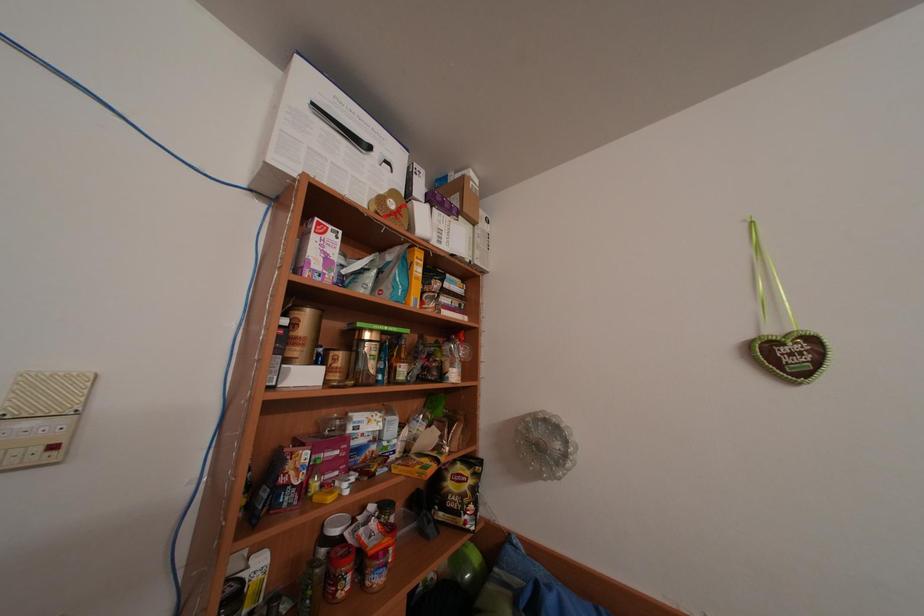
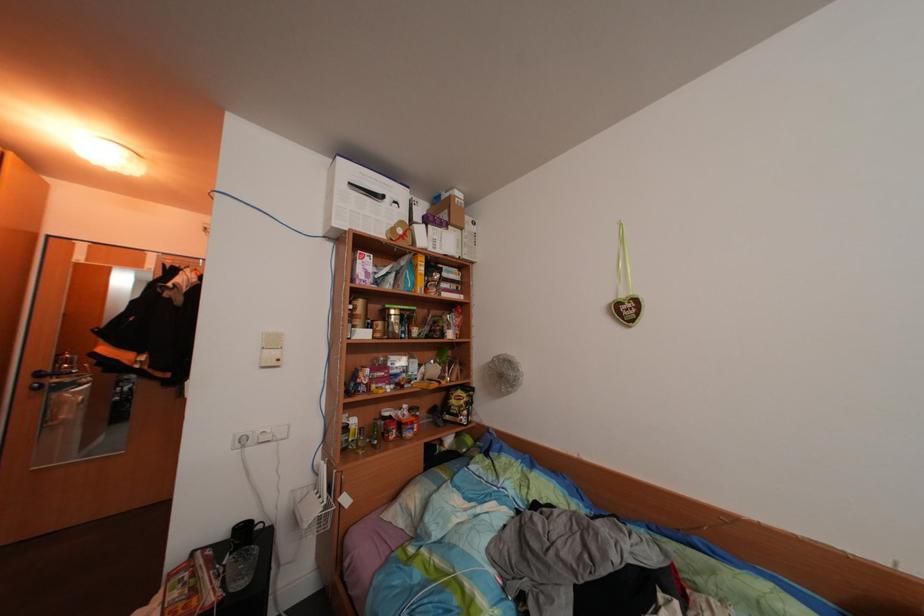
Question: The camera is either moving clockwise (left) or counter-clockwise (right) around the object. The first image is from the beginning of the video and the second image is from the end. Is the camera moving left or right when shooting the video?

Choices:
 (A) Left
 (B) Right

Answer: (B)